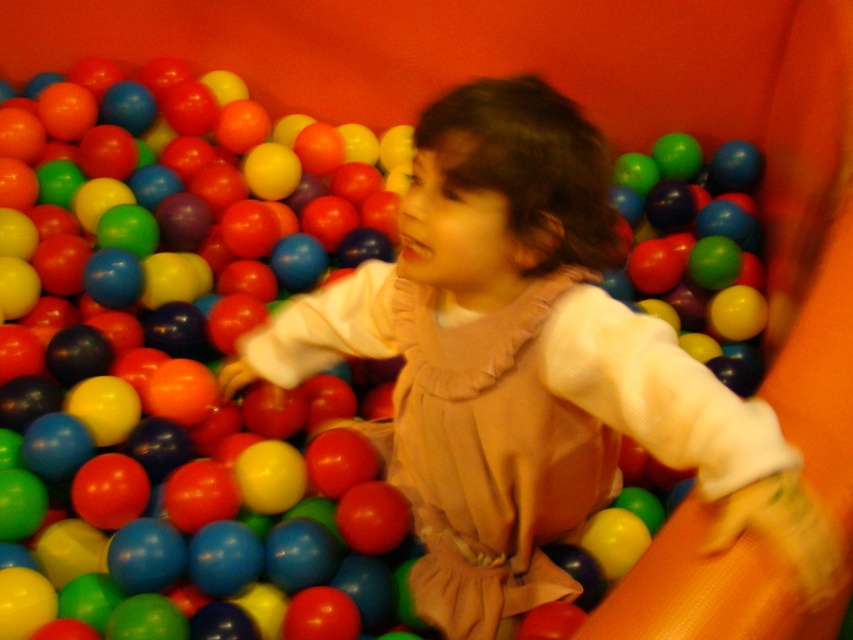
Question: Is orange rubber slide at right below matte plastic ball at upper center?

Choices:
 (A) yes
 (B) no

Answer: (A)

Question: Which point appears closest to the camera in this image?

Choices:
 (A) (482, 502)
 (B) (752, 240)
 (C) (660, 632)

Answer: (C)

Question: Based on their relative distances, which object is farther from the orange rubber slide at right?

Choices:
 (A) matte plastic ball at upper center
 (B) matte beige dress at center

Answer: (B)

Question: Which of these objects is positioned farthest from the matte plastic ball at center?

Choices:
 (A) orange rubber slide at right
 (B) matte plastic ball at upper center
 (C) matte beige dress at center

Answer: (A)

Question: Can you confirm if orange rubber slide at right is positioned below matte plastic ball at upper center?

Choices:
 (A) no
 (B) yes

Answer: (B)

Question: Is matte beige dress at center positioned in front of orange rubber slide at right?

Choices:
 (A) no
 (B) yes

Answer: (A)